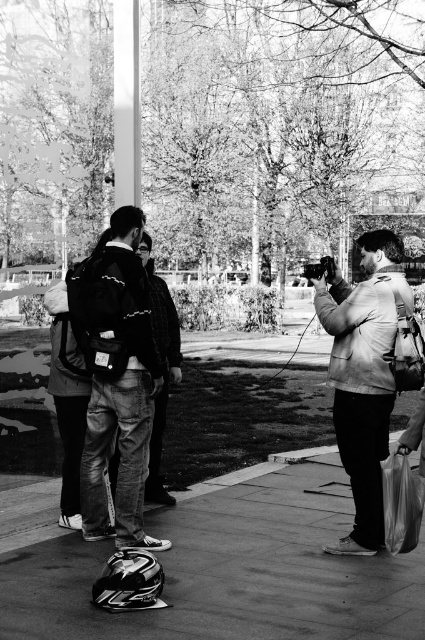
Question: Which of these objects is positioned farthest from the smooth concrete helmet at lower center?

Choices:
 (A) smooth metal pole at center
 (B) dark gray jeans at center
 (C) denim jacket at center

Answer: (A)

Question: Which is nearer to the dark gray jeans at center?

Choices:
 (A) matte beige jacket at right
 (B) denim jacket at center
 (C) smooth metal pole at center
 (D) smooth concrete helmet at lower center

Answer: (B)

Question: Does matte beige jacket at right have a greater width compared to dark gray jeans at center?

Choices:
 (A) yes
 (B) no

Answer: (A)

Question: Does matte beige jacket at right appear on the right side of smooth metal pole at center?

Choices:
 (A) yes
 (B) no

Answer: (A)

Question: Among these points, which one is nearest to the camera?

Choices:
 (A) (119, 540)
 (B) (163, 417)

Answer: (A)

Question: Does matte beige jacket at right have a smaller size compared to dark gray jeans at center?

Choices:
 (A) no
 (B) yes

Answer: (A)